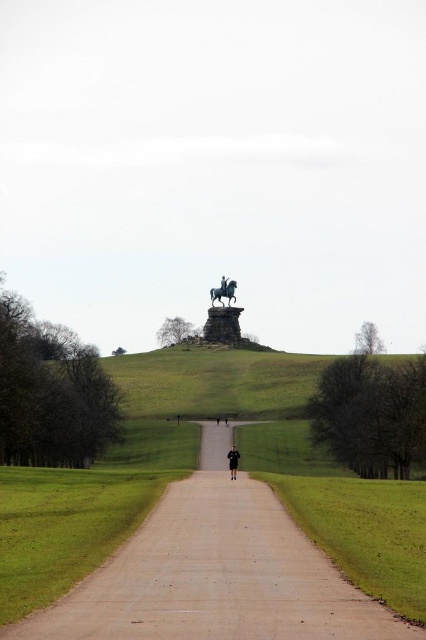
You are a hiker who has lost their jacket and sees the image. You spot a black leather jacket at center and green grass at center. Which one is larger in size?

The green grass at center is bigger than the black leather jacket at center.